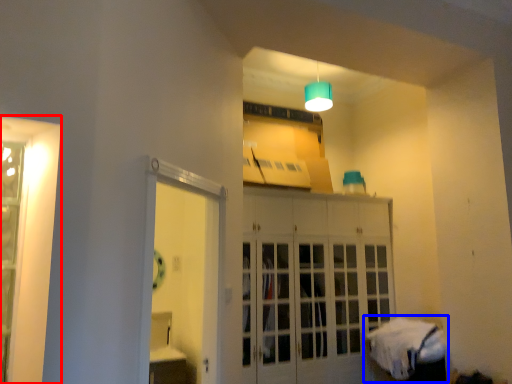
Question: Among these objects, which one is farthest to the camera, window (highlighted by a red box) or bed (highlighted by a blue box)?

Choices:
 (A) window
 (B) bed

Answer: (B)